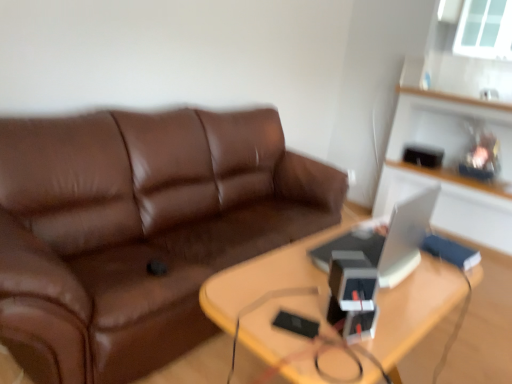
At what (x,y) coordinates should I click in order to perform the action: click on unoccupied area in front of white glossy computer at right. Please return your answer as a coordinate pair (x, y). The height and width of the screenshot is (384, 512). Looking at the image, I should click on (377, 310).